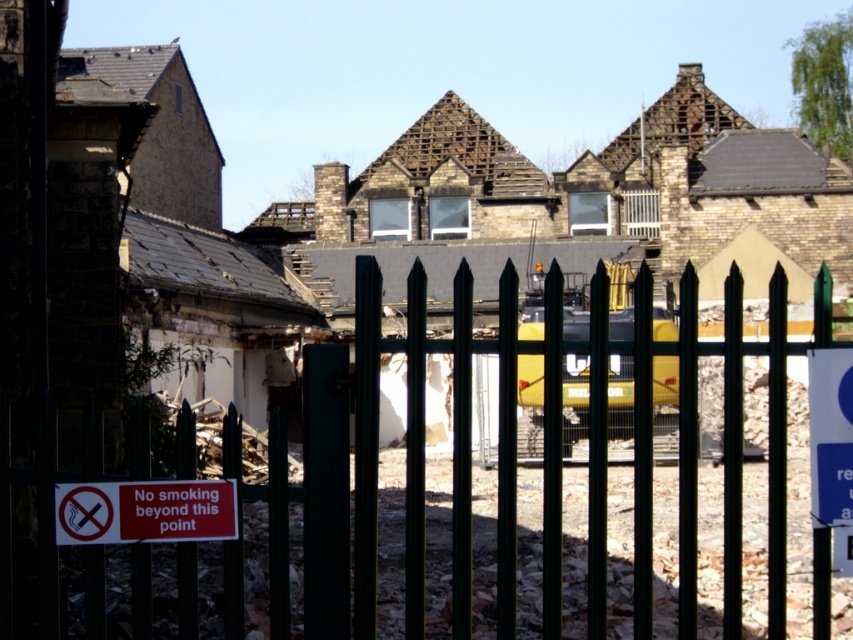
Is green metal fence at center closer to the viewer compared to white plastic sign at right?

Yes, it is.

Which is in front, point (279, 522) or point (846, 492)?

Point (279, 522) is in front.

The width and height of the screenshot is (853, 640). What do you see at coordinates (515, 458) in the screenshot? I see `green metal fence at center` at bounding box center [515, 458].

The image size is (853, 640). What are the coordinates of `green metal fence at center` in the screenshot? It's located at (515, 458).

Does red plastic sign at lower left have a smaller size compared to white plastic sign at right?

Yes.

Is red plastic sign at lower left positioned behind white plastic sign at right?

No, red plastic sign at lower left is closer to the viewer.

Find the location of `red plastic sign at lower left`. red plastic sign at lower left is located at coordinates (144, 512).

Does green metal fence at center have a lesser width compared to red plastic sign at lower left?

No.

Is point (544, 522) closer to viewer compared to point (102, 531)?

No, it is not.

The width and height of the screenshot is (853, 640). I want to click on green metal fence at center, so click(x=515, y=458).